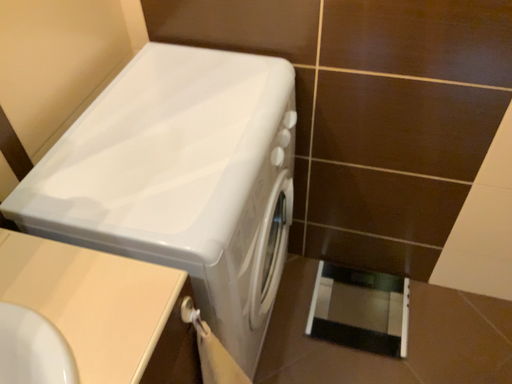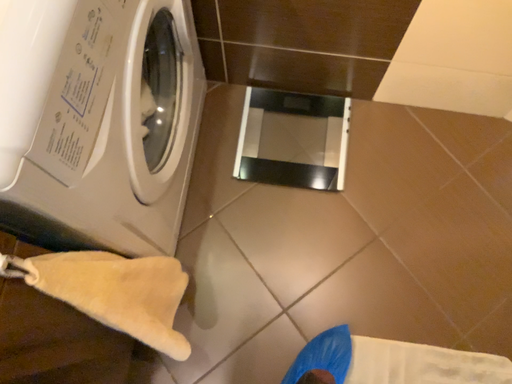
Question: How did the camera likely rotate when shooting the video?

Choices:
 (A) rotated left
 (B) rotated right

Answer: (B)